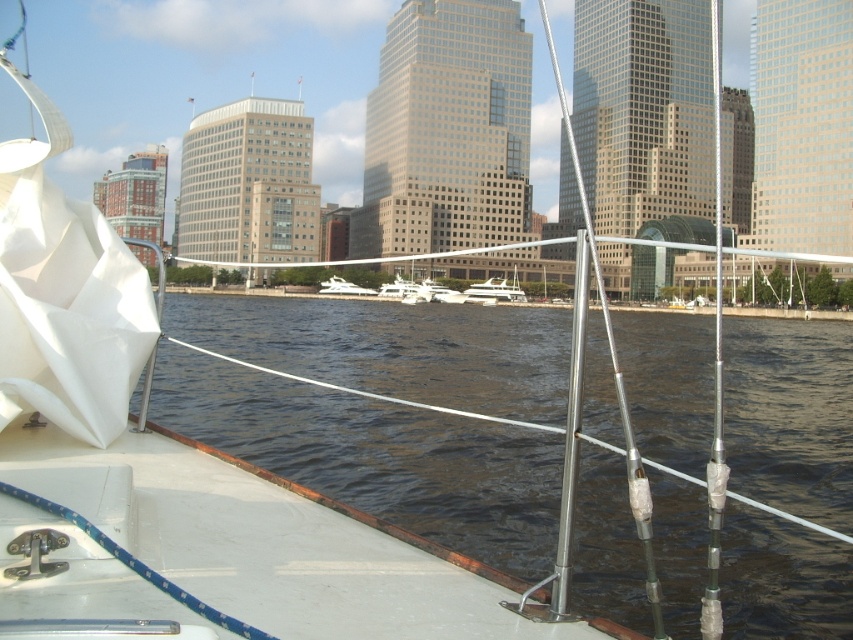
You are standing on the deck of the boat and want to locate the dark blue water at center. According to the coordinates provided, where should you look relative to the boat?

The dark blue water at center is located at coordinates point (378,456), so you should look towards the center of the boat deck where the coordinates indicate the position of the dark blue water at center.

You are a sailor on a boat deck and want to estimate the space between two objects in front of you. Which object is wider when comparing the dark blue water at center and the white glossy yacht at center?

The dark blue water at center is wider than the white glossy yacht at center according to the description.

You are standing on the deck of the boat and want to compare the height of the dark blue water at center and the white glossy yacht at center. Which one is taller?

The dark blue water at center is not as tall as the white glossy yacht at center, so the white glossy yacht at center is taller.